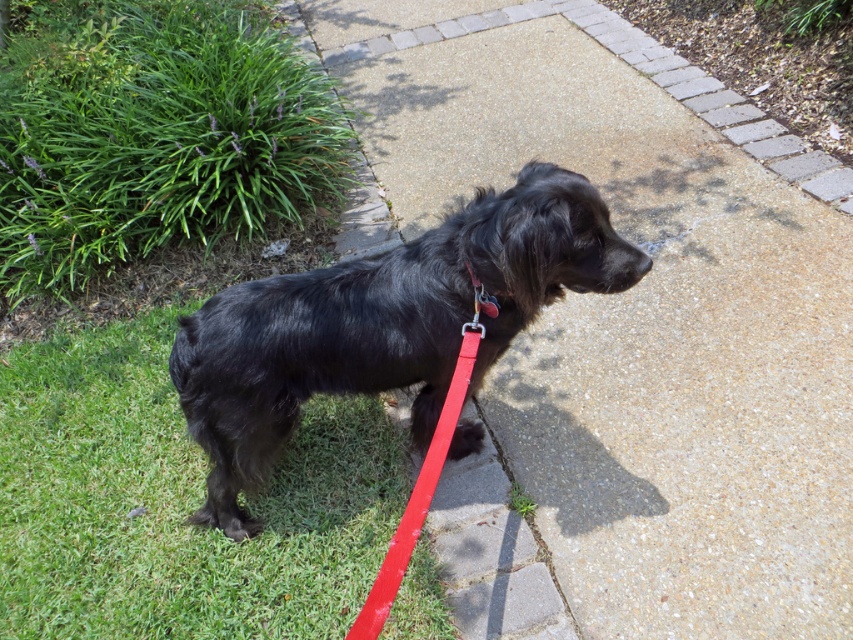
Is point (94, 404) closer to viewer compared to point (296, 211)?

Yes, point (94, 404) is closer to viewer.

Measure the distance between point (67, 634) and camera.

Point (67, 634) is 7.34 feet from camera.

Image resolution: width=853 pixels, height=640 pixels. I want to click on green grass at lower left, so click(x=175, y=502).

Does green leafy grass at upper left appear on the right side of black shaggy dog at center?

Incorrect, green leafy grass at upper left is not on the right side of black shaggy dog at center.

Is point (161, 6) farther from camera compared to point (425, 248)?

Yes, it is.

Which is behind, point (218, 26) or point (421, 300)?

The point (218, 26) is more distant.

Image resolution: width=853 pixels, height=640 pixels. I want to click on green leafy grass at upper left, so click(x=151, y=134).

Is red rubber leash at lower center bigger than red leather collar at center?

Yes, red rubber leash at lower center is bigger than red leather collar at center.

Which is more to the right, red rubber leash at lower center or red leather collar at center?

red leather collar at center

What are the coordinates of `red rubber leash at lower center` in the screenshot? It's located at (418, 497).